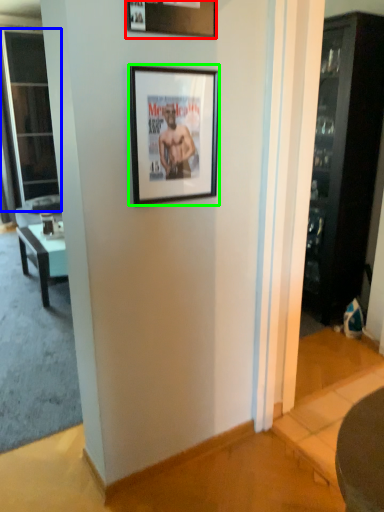
Question: Which is farther away from picture frame (highlighted by a red box)? screen door (highlighted by a blue box) or picture frame (highlighted by a green box)?

Choices:
 (A) screen door
 (B) picture frame

Answer: (A)